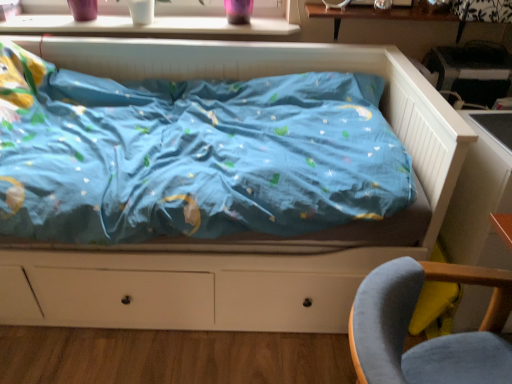
Question: From the image's perspective, is white wood table at right, positioned as the first table in bottom-to-top order, positioned above or below wooden table at upper center, which is counted as the 2th table, starting from the bottom?

Choices:
 (A) above
 (B) below

Answer: (B)

Question: In terms of width, does white wood table at right, positioned as the first table in bottom-to-top order, look wider or thinner when compared to wooden table at upper center, the 1th table from the top?

Choices:
 (A) wide
 (B) thin

Answer: (A)

Question: Considering the real-world distances, which object is closest to the white glossy window sill at upper center?

Choices:
 (A) matte blue bed at center
 (B) velvet grey chair at lower right
 (C) white wood table at right, which ranks as the second table in top-to-bottom order
 (D) wooden table at upper center, the 1th table from the top

Answer: (D)

Question: Estimate the real-world distances between objects in this image. Which object is farther from the velvet grey chair at lower right?

Choices:
 (A) white glossy window sill at upper center
 (B) matte blue bed at center
 (C) white wood table at right, which ranks as the second table in top-to-bottom order
 (D) wooden table at upper center, the 1th table from the top

Answer: (A)